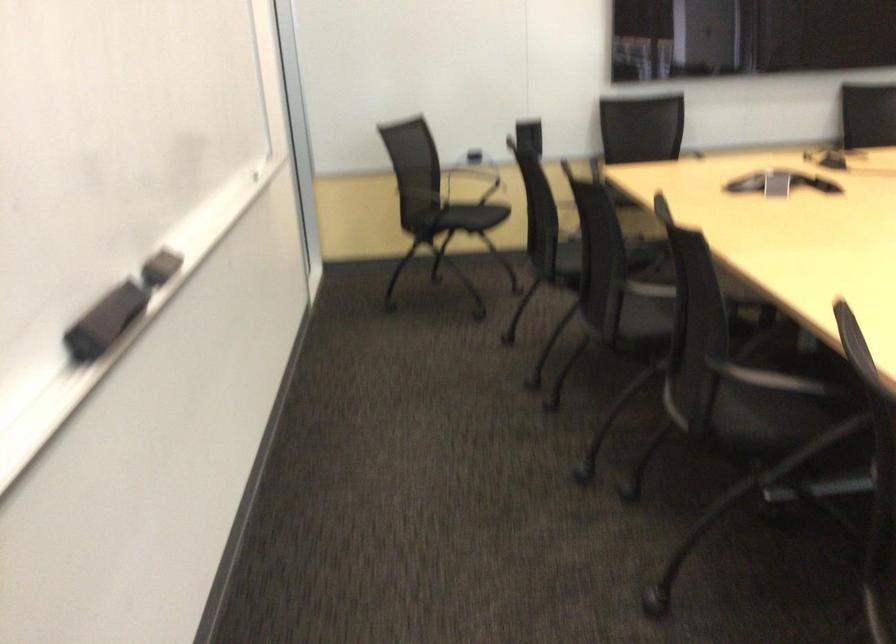
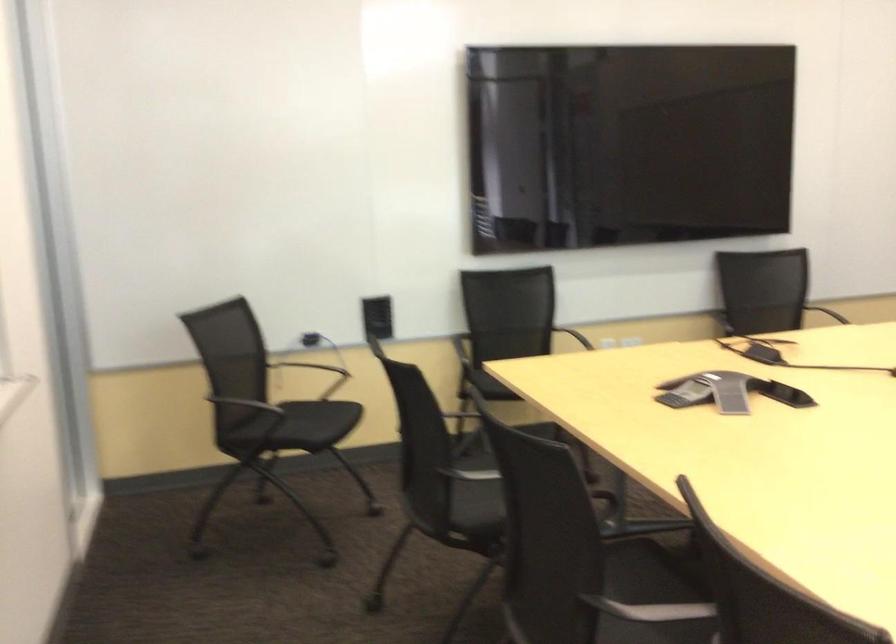
Question: What movement of the cameraman would produce the second image?

Choices:
 (A) Left
 (B) Right
 (C) Forward
 (D) Backward

Answer: (C)